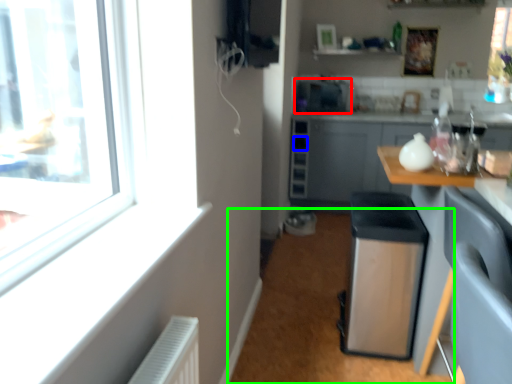
Question: Which is nearer to the appliance (highlighted by a red box)? drawer (highlighted by a blue box) or plain (highlighted by a green box).

Choices:
 (A) drawer
 (B) plain

Answer: (A)